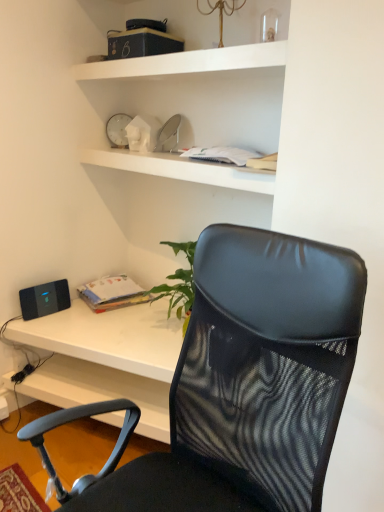
Question: Is there a large distance between black mesh chair at center and white plastic clock at upper center?

Choices:
 (A) yes
 (B) no

Answer: (A)

Question: Is black mesh chair at center completely or partially outside of white plastic clock at upper center?

Choices:
 (A) yes
 (B) no

Answer: (A)

Question: From the image's perspective, is black mesh chair at center on top of white plastic clock at upper center?

Choices:
 (A) yes
 (B) no

Answer: (B)

Question: Is black mesh chair at center taller than white plastic clock at upper center?

Choices:
 (A) no
 (B) yes

Answer: (B)

Question: Does black mesh chair at center have a greater width compared to white plastic clock at upper center?

Choices:
 (A) no
 (B) yes

Answer: (B)

Question: Considering the relative positions of black mesh chair at center and white plastic clock at upper center in the image provided, is black mesh chair at center in front of white plastic clock at upper center?

Choices:
 (A) no
 (B) yes

Answer: (B)

Question: Can you confirm if white matte shelf at upper center is taller than white plastic clock at upper center?

Choices:
 (A) no
 (B) yes

Answer: (A)

Question: Is white matte shelf at upper center shorter than white plastic clock at upper center?

Choices:
 (A) yes
 (B) no

Answer: (A)

Question: Is white matte shelf at upper center facing away from white plastic clock at upper center?

Choices:
 (A) yes
 (B) no

Answer: (B)

Question: From a real-world perspective, is white matte shelf at upper center located higher than white plastic clock at upper center?

Choices:
 (A) no
 (B) yes

Answer: (B)

Question: Is white matte shelf at upper center placed right next to white plastic clock at upper center?

Choices:
 (A) yes
 (B) no

Answer: (B)

Question: Could you tell me if white matte shelf at upper center is turned towards white plastic clock at upper center?

Choices:
 (A) yes
 (B) no

Answer: (B)

Question: Does black matte speaker at lower left appear on the right side of matte paper book at center?

Choices:
 (A) no
 (B) yes

Answer: (A)